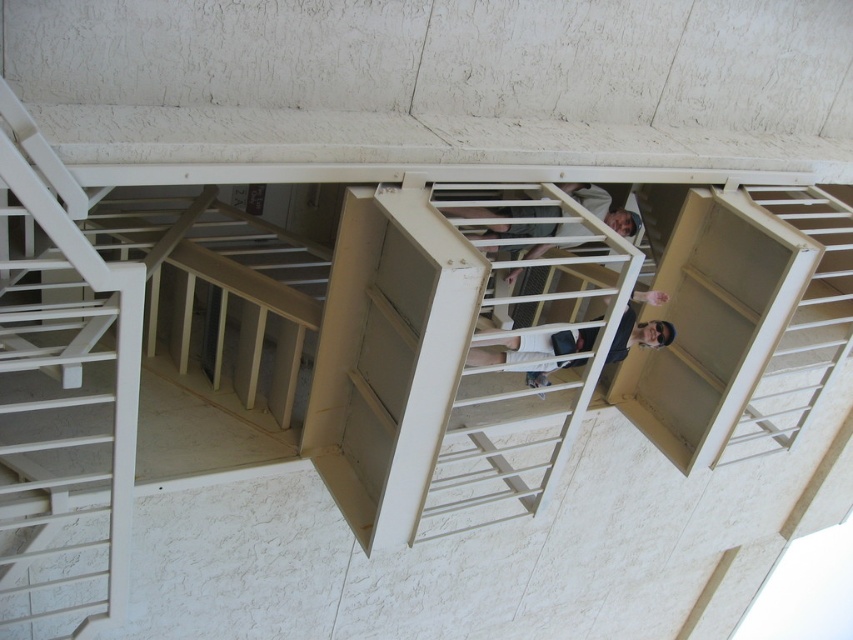
You are standing at the bottom of the spiral staircase and want to reach the top. You see a white matte ladder at left and a matte white shirt at center. Which object is taller and would require more effort to climb?

The white matte ladder at left is taller than the matte white shirt at center, so it would require more effort to climb.

You are standing at the bottom of the spiral staircase and want to reach the person in the matte white shirt at upper center. Which direction should you move relative to the white matte ladder at left?

The white matte ladder at left is positioned under the matte white shirt at upper center, so you should move towards the white matte ladder at left to reach the person in the matte white shirt at upper center.

You are standing at the base of the spiral staircase and want to take a photo of two points marked in the scene. The first point is at coordinates point (115, 474) and the second is at point (561, 216). Which point will appear larger in your photo?

Point (115, 474) is closer to the camera than point (561, 216), so it will appear larger in the photo.